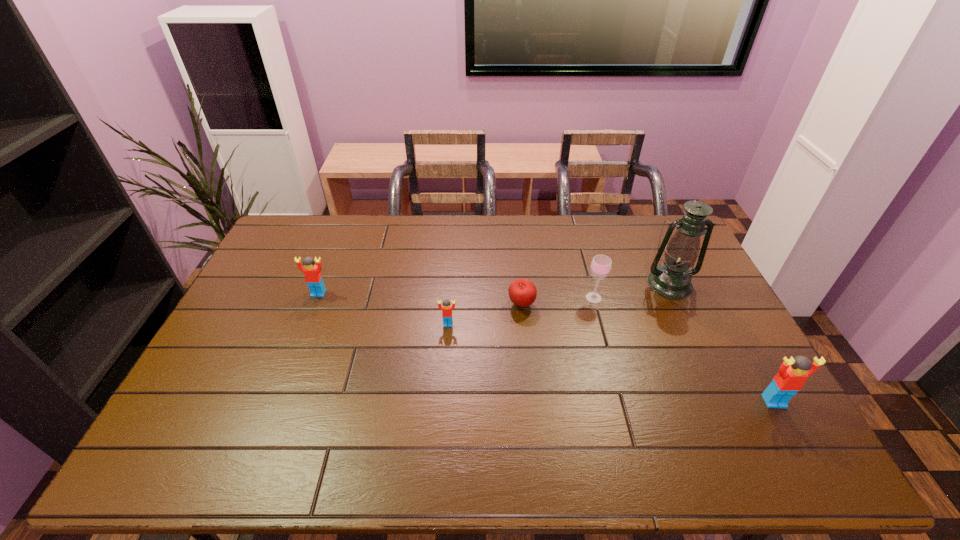
At what (x,y) coordinates should I click in order to perform the action: click on the second tallest Lego. Please return your answer as a coordinate pair (x, y). Looking at the image, I should click on (313, 277).

Image resolution: width=960 pixels, height=540 pixels. In order to click on the leftmost Lego in this screenshot , I will do `click(313, 277)`.

This screenshot has width=960, height=540. Identify the location of the second nearest Lego. (446, 309).

Locate an element on the screen. the second Lego from right to left is located at coordinates pyautogui.click(x=446, y=309).

Where is `the rightmost Lego`? The width and height of the screenshot is (960, 540). the rightmost Lego is located at coordinates (793, 373).

Locate an element on the screen. The width and height of the screenshot is (960, 540). the nearest object is located at coordinates pos(793,373).

Locate an element on the screen. The image size is (960, 540). the tallest object is located at coordinates (672, 279).

Identify the location of apple. (522, 292).

What are the coordinates of `wineglass` in the screenshot? It's located at (601, 265).

Identify the location of free region located on the face of the leftmost Lego. (302, 335).